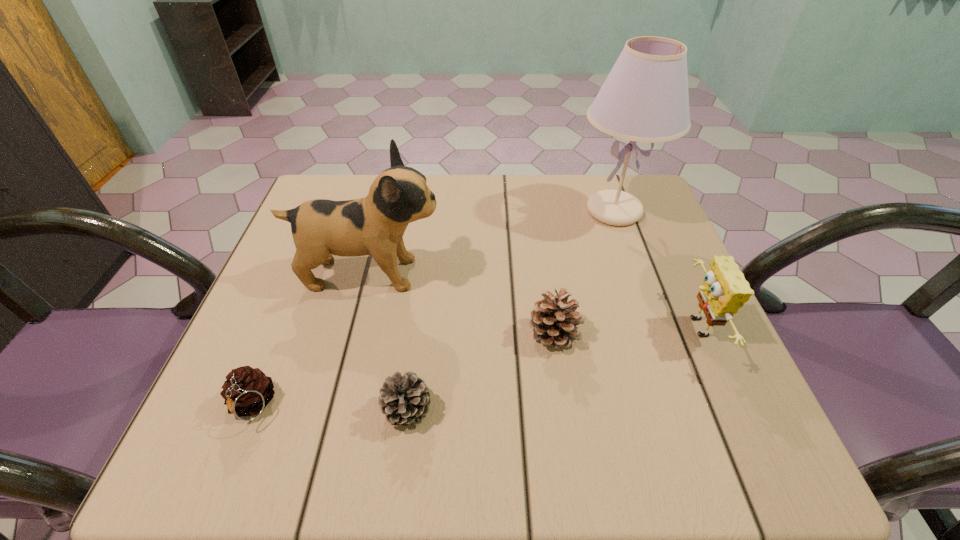
This screenshot has width=960, height=540. In order to click on object that is at the near left corner in this screenshot , I will do `click(247, 391)`.

Find the location of a particular element. The height and width of the screenshot is (540, 960). object that is at the far right corner is located at coordinates (x=645, y=98).

Where is `blank space at the far edge`? Image resolution: width=960 pixels, height=540 pixels. blank space at the far edge is located at coordinates (599, 227).

In the image, there is a desktop. Where is `blank space at the near edge`? blank space at the near edge is located at coordinates (624, 429).

In the image, there is a desktop. Where is `vacant space at the right edge`? vacant space at the right edge is located at coordinates (640, 256).

In the image, there is a desktop. Identify the location of free region at the far left corner. (368, 191).

This screenshot has width=960, height=540. What are the coordinates of `free location at the near left corner of the desktop` in the screenshot? It's located at (243, 426).

In the image, there is a desktop. Where is `vacant space at the far right corner`? vacant space at the far right corner is located at coordinates (652, 191).

Where is `vacant space that's between the sponge and the second pinecone from left to right`? vacant space that's between the sponge and the second pinecone from left to right is located at coordinates point(551,368).

Locate an element on the screen. unoccupied position between the puppy and the sponge is located at coordinates (533, 301).